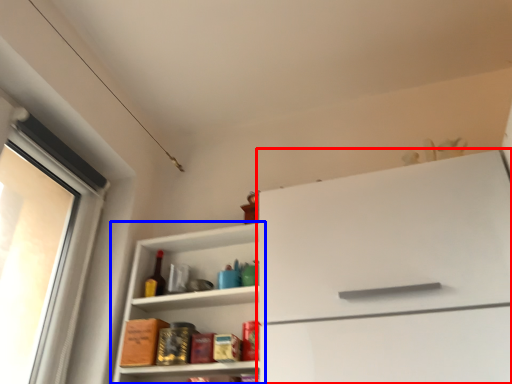
Question: Among these objects, which one is nearest to the camera, cabinetry (highlighted by a red box) or shelf (highlighted by a blue box)?

Choices:
 (A) cabinetry
 (B) shelf

Answer: (A)